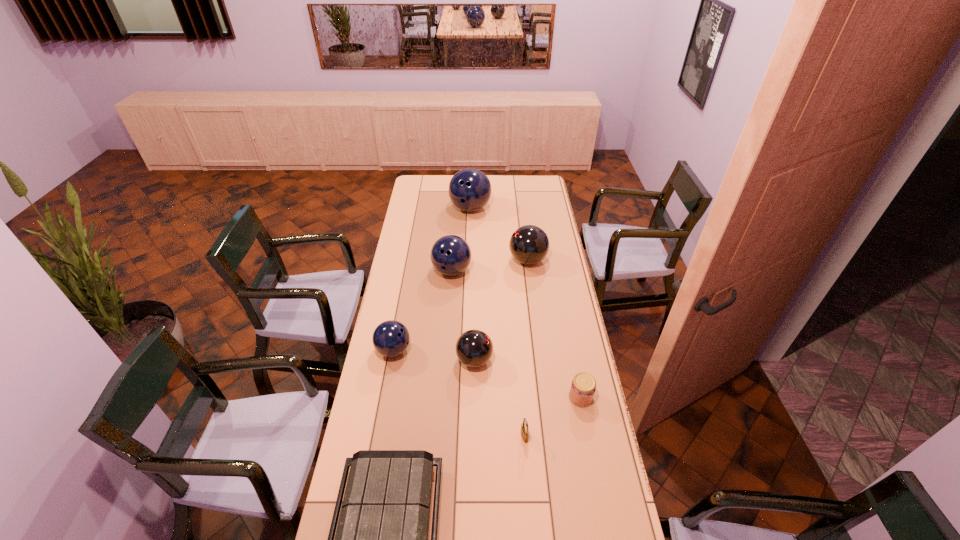
At what (x,y) coordinates should I click in order to perform the action: click on the tallest bowling ball. Please return your answer as a coordinate pair (x, y). The width and height of the screenshot is (960, 540). Looking at the image, I should click on (469, 189).

I want to click on the farthest object, so click(469, 189).

Where is `the bigger black bowling ball`? This screenshot has height=540, width=960. the bigger black bowling ball is located at coordinates (529, 244).

Find the location of a particular element. Image resolution: width=960 pixels, height=540 pixels. the farther black bowling ball is located at coordinates (529, 244).

The height and width of the screenshot is (540, 960). What are the coordinates of `the second nearest blue bowling ball` in the screenshot? It's located at click(x=450, y=255).

This screenshot has height=540, width=960. I want to click on the smallest blue bowling ball, so click(x=391, y=338).

The width and height of the screenshot is (960, 540). I want to click on the leftmost bowling ball, so click(x=391, y=338).

The height and width of the screenshot is (540, 960). In order to click on the nearer black bowling ball in this screenshot , I will do `click(474, 348)`.

Where is `the smaller black bowling ball`? the smaller black bowling ball is located at coordinates (474, 348).

You are a GUI agent. You are given a task and a screenshot of the screen. Output one action in this format:
    pyautogui.click(x=<x>, y=<y>)
    Task: Click on the jam
    The height and width of the screenshot is (540, 960).
    Given the screenshot: What is the action you would take?
    pyautogui.click(x=582, y=390)